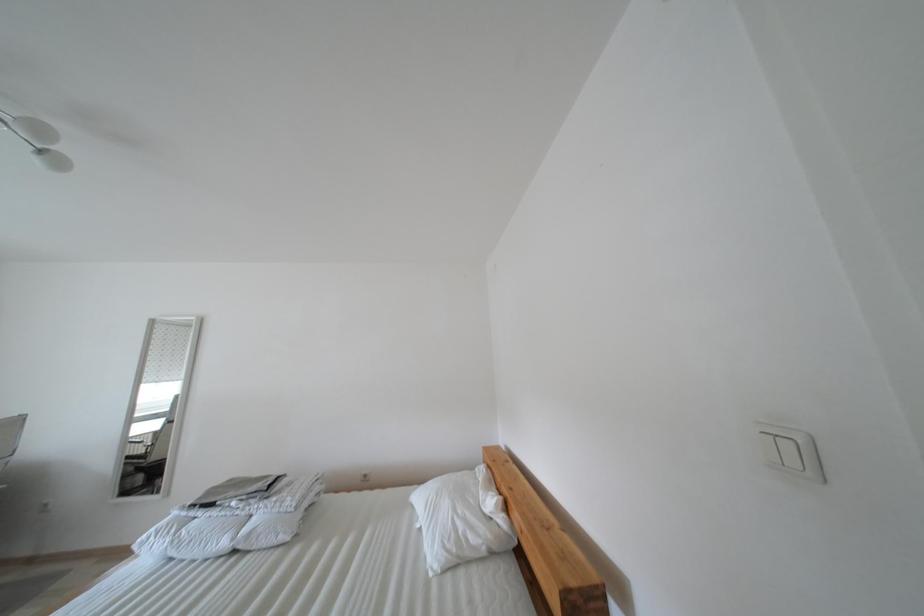
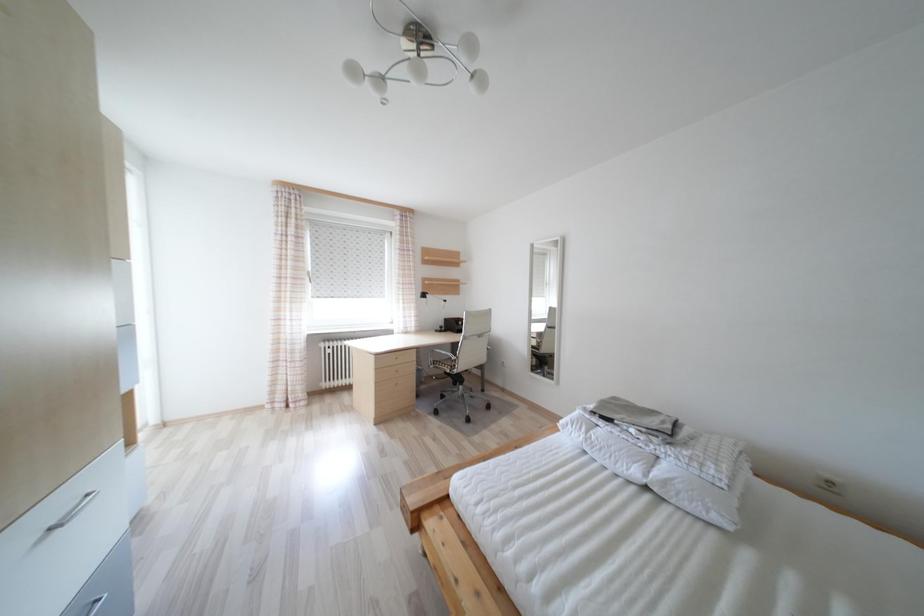
Question: The camera is either moving clockwise (left) or counter-clockwise (right) around the object. The first image is from the beginning of the video and the second image is from the end. Is the camera moving left or right when shooting the video?

Choices:
 (A) Left
 (B) Right

Answer: (B)